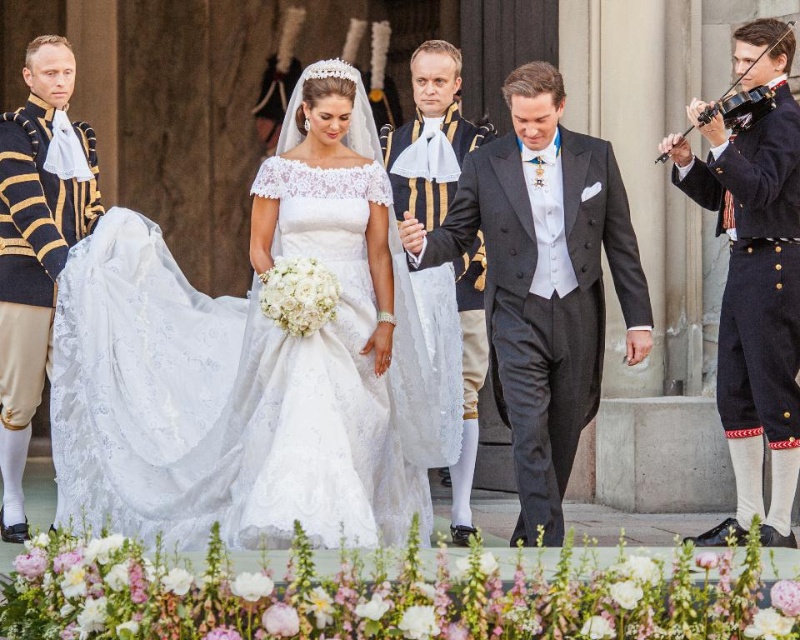
Question: Is white lace dress at center thinner than gold striped uniform at left?

Choices:
 (A) yes
 (B) no

Answer: (B)

Question: Does white lace dress at center have a lesser width compared to matte black suit at center?

Choices:
 (A) yes
 (B) no

Answer: (B)

Question: Which point is closer to the camera?

Choices:
 (A) (110, 484)
 (B) (420, 88)
 (C) (788, 29)

Answer: (A)

Question: Based on their relative distances, which object is nearer to the white lace dress at center?

Choices:
 (A) lace fabric dress at center
 (B) dark blue uniform at right
 (C) matte black suit at center

Answer: (A)

Question: Can you confirm if lace fabric dress at center is positioned above black satin tuxedo at center?

Choices:
 (A) no
 (B) yes

Answer: (A)

Question: Which of these objects is positioned closest to the white lace dress at center?

Choices:
 (A) gold striped uniform at left
 (B) lace fabric dress at center
 (C) black satin tuxedo at center

Answer: (B)